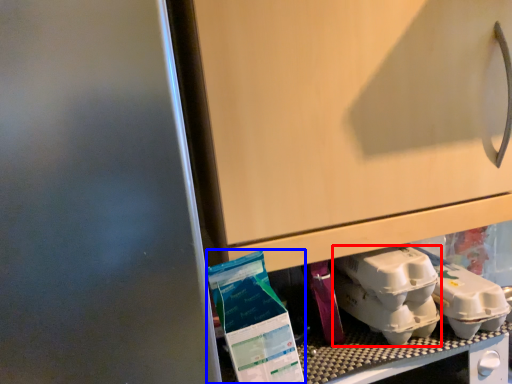
Question: Which of the following is the closest to the observer, yoghurt (highlighted by a red box) or yoghurt (highlighted by a blue box)?

Choices:
 (A) yoghurt
 (B) yoghurt

Answer: (B)